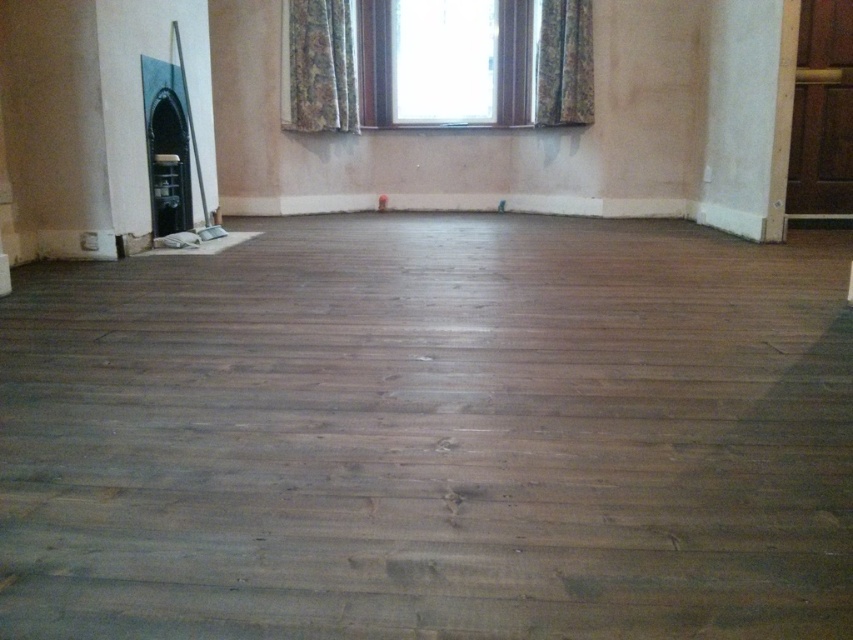
You need to place a large rectangular rug that is 2 meters wide in this room. Given the dark brown wood floor at center and the clear glass window at upper center, which object would the rug more likely fit in terms of width?

The dark brown wood floor at center has a larger width than the clear glass window at upper center, so the rug would more likely fit on the dark brown wood floor at center.

You are standing in the room and want to move from the dark brown wood floor at center to the textured floral fabric at upper center. Which direction should you move to get closer to the fabric?

You should move to the right because the dark brown wood floor at center is to the left of the textured floral fabric at upper center, so moving right would bring you closer to the fabric.